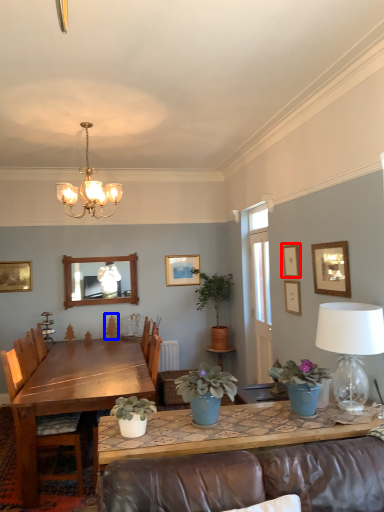
Question: Which point is further to the camera, picture frame (highlighted by a red box) or plant (highlighted by a blue box)?

Choices:
 (A) picture frame
 (B) plant

Answer: (B)